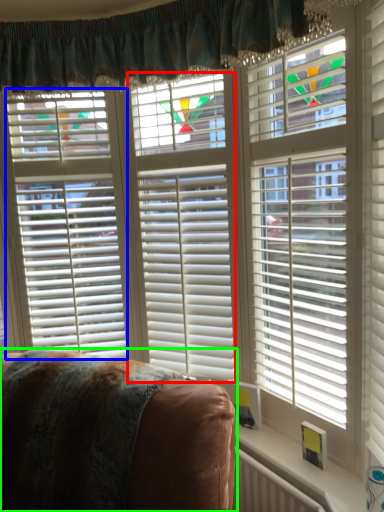
Question: Which object is the closest to the blind (highlighted by a red box)? Choose among these: blind (highlighted by a blue box) or furniture (highlighted by a green box).

Choices:
 (A) blind
 (B) furniture

Answer: (A)